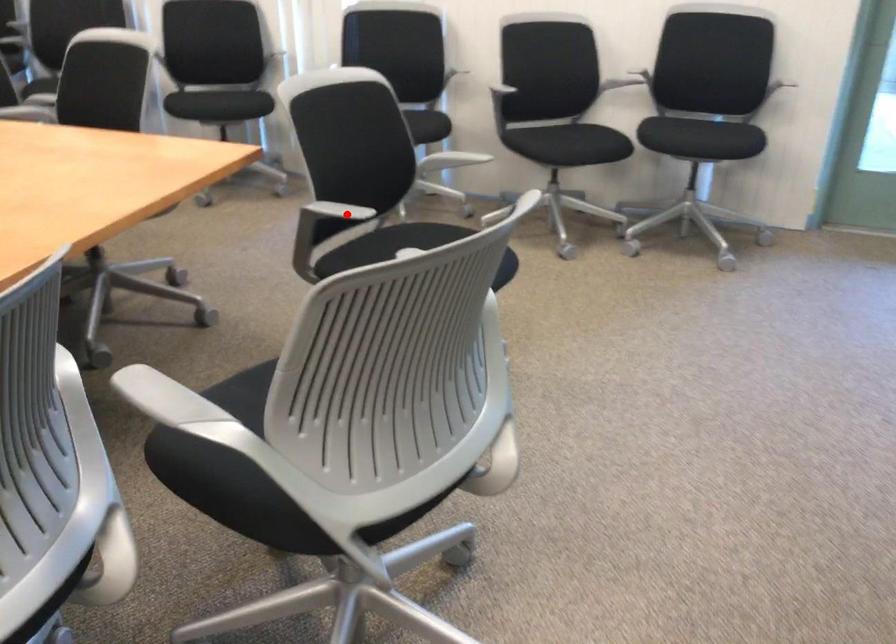
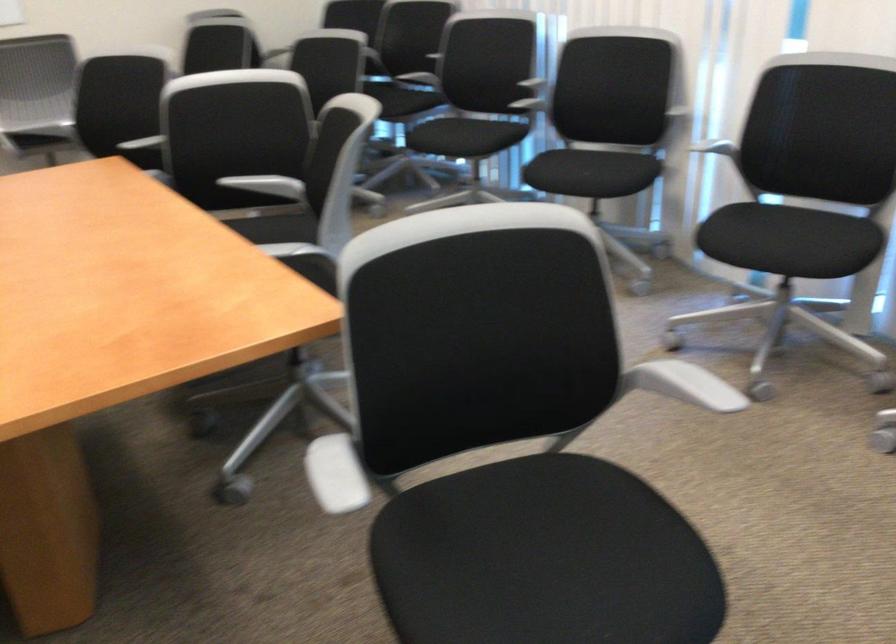
The point at the highlighted location is marked in the first image. Where is the corresponding point in the second image?

(334, 474)